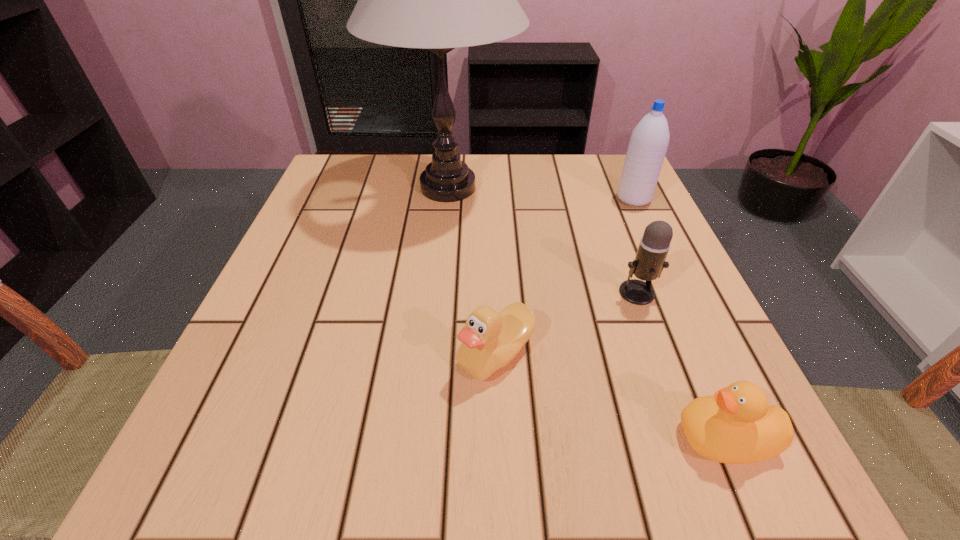
Identify the location of free space located 0.170m on the left of the microphone. This screenshot has width=960, height=540. (520, 293).

Where is `vacant area situated 0.180m at the beak of the farther duck`? vacant area situated 0.180m at the beak of the farther duck is located at coordinates (338, 354).

This screenshot has height=540, width=960. I want to click on vacant space located at the beak of the farther duck, so click(404, 354).

At what (x,y) coordinates should I click in order to perform the action: click on vacant position located 0.330m at the beak of the farther duck. Please return your answer as a coordinate pair (x, y). This screenshot has width=960, height=540. Looking at the image, I should click on (239, 354).

Where is `free region located on the face of the nearer duck`? The image size is (960, 540). free region located on the face of the nearer duck is located at coordinates (446, 438).

Locate an element on the screen. The width and height of the screenshot is (960, 540). vacant space situated on the face of the nearer duck is located at coordinates (500, 438).

In order to click on free spot located on the face of the nearer duck in this screenshot , I will do `click(625, 438)`.

Identify the location of lamp at the far edge. The height and width of the screenshot is (540, 960). (438, 0).

You are a GUI agent. You are given a task and a screenshot of the screen. Output one action in this format:
    pyautogui.click(x=<x>, y=<y>)
    Task: Click on the water bottle present at the far edge
    
    Given the screenshot: What is the action you would take?
    pyautogui.click(x=647, y=148)

This screenshot has height=540, width=960. I want to click on object that is at the near edge, so click(x=736, y=425).